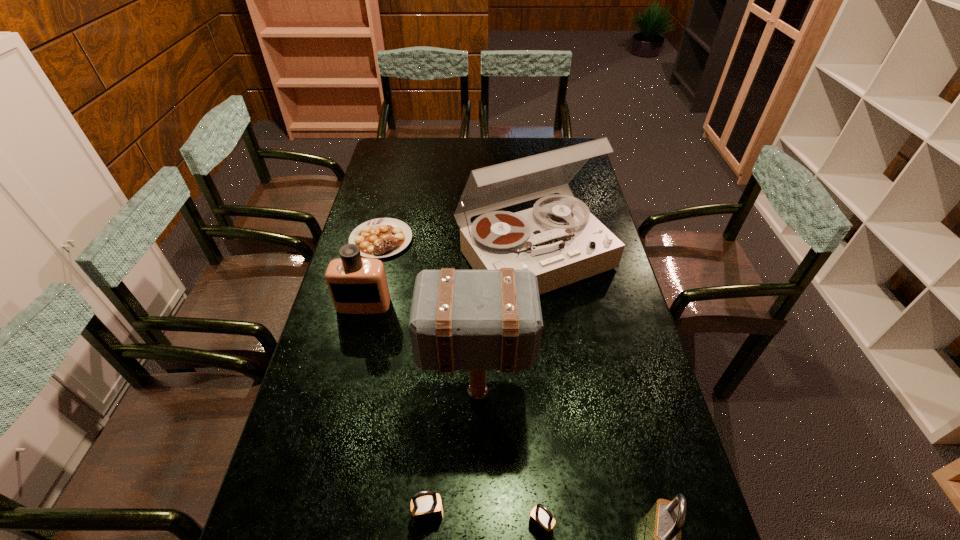
In order to click on vacant space at the right edge of the desktop in this screenshot , I will do 610,272.

Identify the location of vacant space at the near left corner of the desktop. (315, 526).

The width and height of the screenshot is (960, 540). In the image, there is a desktop. Find the location of `vacant space at the far right corner`. vacant space at the far right corner is located at coordinates (562, 141).

Identify the location of free spot between the third shortest object and the perfume. (396, 409).

Identify the location of unoccupied position between the mallet and the leftmost padlock. The width and height of the screenshot is (960, 540). (452, 455).

You are a GUI agent. You are given a task and a screenshot of the screen. Output one action in this format:
    pyautogui.click(x=<x>, y=<y>)
    Task: Click on the free space between the third shortest object and the mallet
    
    Given the screenshot: What is the action you would take?
    (452, 455)

Select which object is the closest to the rightmost padlock. Please provide its 2D coordinates. Your answer should be formatted as a tuple, i.e. [(x, y)], where the tuple contains the x and y coordinates of a point satisfying the conditions above.

[(541, 518)]

You are a GUI agent. You are given a task and a screenshot of the screen. Output one action in this format:
    pyautogui.click(x=<x>, y=<y>)
    Task: Click on the object identified as the fifth closest to the second shortest object
    This screenshot has height=540, width=960.
    Given the screenshot: What is the action you would take?
    pyautogui.click(x=357, y=285)

Find the location of a particular element. The image size is (960, 540). padlock identified as the second closest to the record player is located at coordinates (541, 518).

Find the location of a particular element. padlock that can be found as the closest to the second shortest object is located at coordinates (665, 519).